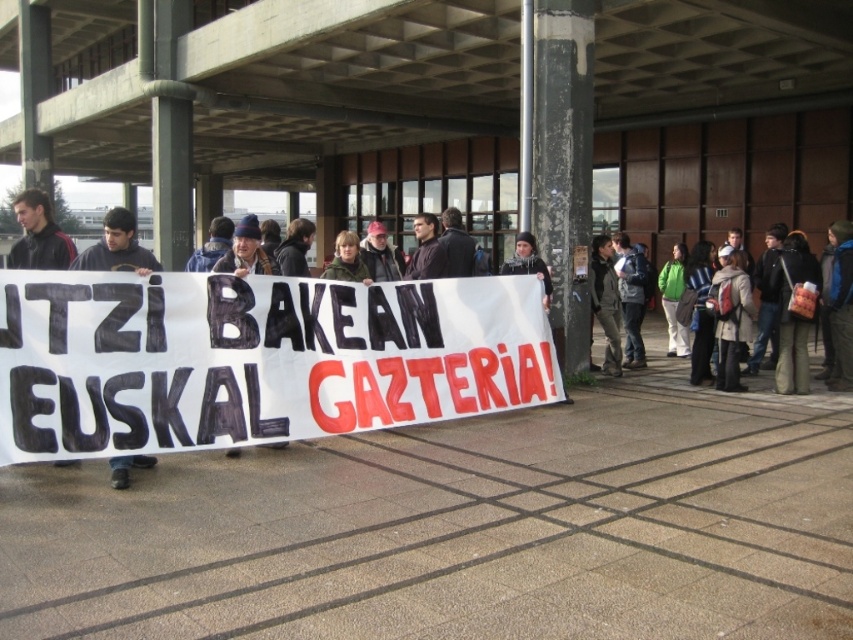
Question: Which is farther from the matte black jacket at left?

Choices:
 (A) white woolen hat at center
 (B) dark blue jacket at center
 (C) dark gray jacket at center

Answer: (B)

Question: Which of the following is the closest to the observer?

Choices:
 (A) white woolen hat at center
 (B) dark blue jacket at center
 (C) dark gray knit hat at center
 (D) dark gray jacket at center

Answer: (C)

Question: Does dark gray jacket at center have a smaller size compared to dark gray knit hat at center?

Choices:
 (A) no
 (B) yes

Answer: (A)

Question: Is matte black jacket at left wider than dark gray jacket at center?

Choices:
 (A) no
 (B) yes

Answer: (B)

Question: Is black fabric sign at left positioned before matte black jacket at left?

Choices:
 (A) yes
 (B) no

Answer: (A)

Question: Based on their relative distances, which object is farther from the white woolen hat at center?

Choices:
 (A) dark blue jacket at center
 (B) dark gray knit hat at center
 (C) matte black jacket at left
 (D) dark gray jacket at center

Answer: (C)